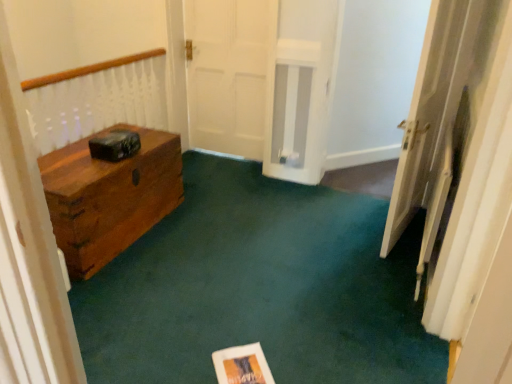
Measure the distance between point (x=430, y=73) and camera.

The distance of point (x=430, y=73) from camera is 2.23 meters.

Where is `white wooden door at right`? white wooden door at right is located at coordinates (x=432, y=110).

Image resolution: width=512 pixels, height=384 pixels. What do you see at coordinates (432, 110) in the screenshot?
I see `white wooden door at right` at bounding box center [432, 110].

The width and height of the screenshot is (512, 384). I want to click on matte paper at center, so click(x=242, y=365).

What do you see at coordinates (242, 365) in the screenshot?
I see `matte paper at center` at bounding box center [242, 365].

At what (x,y) coordinates should I click in order to perform the action: click on white wooden door at right. Please return your answer as a coordinate pair (x, y). This screenshot has width=512, height=384. Looking at the image, I should click on (432, 110).

Looking at this image, which is more to the right, matte paper at center or white wooden door at right?

Positioned to the right is white wooden door at right.

Between matte paper at center and white wooden door at right, which one is positioned behind?

white wooden door at right is further from the camera.

Is point (260, 349) more distant than point (419, 181)?

No, it is in front of (419, 181).

From the image's perspective, is matte paper at center over white wooden door at right?

Actually, matte paper at center appears below white wooden door at right in the image.

From a real-world perspective, between matte paper at center and white wooden door at right, who is vertically higher?

white wooden door at right, from a real-world perspective.

Considering the relative sizes of matte paper at center and white wooden door at right in the image provided, is matte paper at center thinner than white wooden door at right?

No.

Can you confirm if matte paper at center is taller than white wooden door at right?

No, matte paper at center is not taller than white wooden door at right.

In terms of size, does matte paper at center appear bigger or smaller than white wooden door at right?

Considering their sizes, matte paper at center takes up less space than white wooden door at right.

Is matte paper at center positioned beyond the bounds of white wooden door at right?

Yes, matte paper at center is outside of white wooden door at right.

Are matte paper at center and white wooden door at right making contact?

No.

Is matte paper at center facing towards white wooden door at right?

No, matte paper at center is not turned towards white wooden door at right.

What's the angular difference between matte paper at center and white wooden door at right's facing directions?

matte paper at center and white wooden door at right are facing 126 degrees away from each other.

How far apart are matte paper at center and white wooden door at right?

matte paper at center and white wooden door at right are 1.42 meters apart.

Locate an element on the screen. The width and height of the screenshot is (512, 384). door that is above the matte paper at center (from the image's perspective) is located at coordinates (432, 110).

In the scene shown: Considering the relative positions of white wooden door at right and matte paper at center in the image provided, is white wooden door at right to the left of matte paper at center from the viewer's perspective?

Incorrect, white wooden door at right is not on the left side of matte paper at center.

Considering their positions, is white wooden door at right located in front of or behind matte paper at center?

white wooden door at right is positioned farther from the viewer than matte paper at center.

Which is closer, [441,161] or [224,380]?

Point [441,161] is farther from the camera than point [224,380].

From the image's perspective, is white wooden door at right positioned above or below matte paper at center?

white wooden door at right is situated higher than matte paper at center in the image.

From a real-world perspective, relative to matte paper at center, is white wooden door at right vertically above or below?

In terms of real-world spatial position, white wooden door at right is above matte paper at center.

Is white wooden door at right thinner than matte paper at center?

Correct, the width of white wooden door at right is less than that of matte paper at center.

Looking at this image, which of these two, white wooden door at right or matte paper at center, stands taller?

With more height is white wooden door at right.

Who is bigger, white wooden door at right or matte paper at center?

With larger size is white wooden door at right.

From the picture: Choose the correct answer: Is white wooden door at right inside matte paper at center or outside it?

white wooden door at right is located beyond the bounds of matte paper at center.

Are white wooden door at right and matte paper at center far apart?

Absolutely, white wooden door at right is distant from matte paper at center.

Is white wooden door at right looking in the opposite direction of matte paper at center?

No.

How many degrees apart are the facing directions of white wooden door at right and matte paper at center?

The angle between the facing direction of white wooden door at right and the facing direction of matte paper at center is 126 degrees.

How distant is white wooden door at right from matte paper at center?

white wooden door at right and matte paper at center are 4.66 feet apart from each other.

This screenshot has width=512, height=384. In order to click on copy below the white wooden door at right (from the image's perspective) in this screenshot , I will do `click(242, 365)`.

Locate an element on the screen. door behind the matte paper at center is located at coordinates (432, 110).

I want to click on copy lying on the left of white wooden door at right, so click(x=242, y=365).